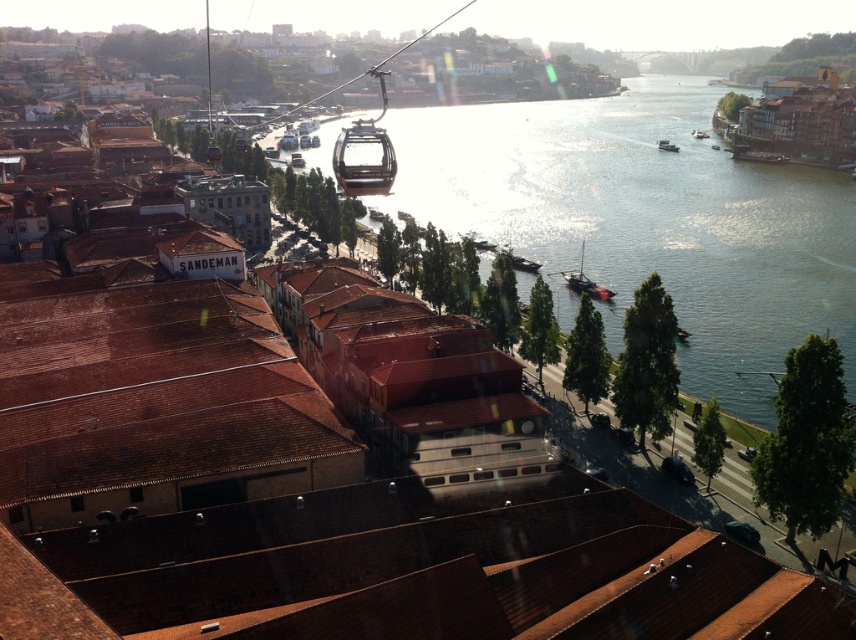
Describe the element at coordinates (646, 220) in the screenshot. This screenshot has width=856, height=640. I see `greenish-blue water at center` at that location.

Who is taller, greenish-blue water at center or matte glass cable car at upper center?

Standing taller between the two is greenish-blue water at center.

Who is more forward, (776, 310) or (340, 164)?

Point (340, 164) is more forward.

Locate an element on the screen. This screenshot has width=856, height=640. greenish-blue water at center is located at coordinates (646, 220).